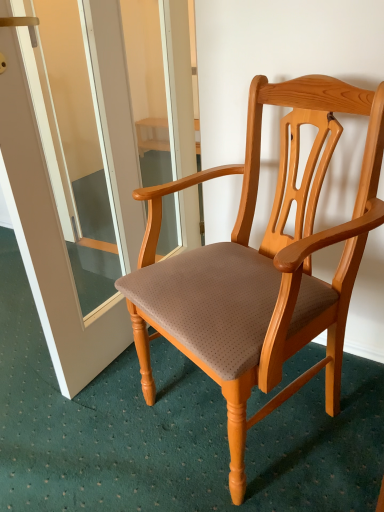
Locate an element on the screen. Image resolution: width=384 pixels, height=512 pixels. free spot to the left of light brown wood chair at center is located at coordinates (72, 434).